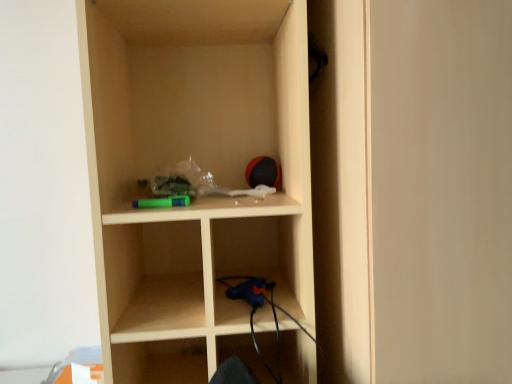
Question: Considering the relative positions of matte wood door at center and matte wood shelf at center in the image provided, is matte wood door at center to the left or to the right of matte wood shelf at center?

Choices:
 (A) right
 (B) left

Answer: (A)

Question: Looking at their shapes, would you say matte wood door at center is wider or thinner than matte wood shelf at center?

Choices:
 (A) wide
 (B) thin

Answer: (A)

Question: From the image's perspective, is matte wood door at center above or below matte wood shelf at center?

Choices:
 (A) below
 (B) above

Answer: (A)

Question: From the image's perspective, is matte wood shelf at center positioned above or below matte wood door at center?

Choices:
 (A) above
 (B) below

Answer: (A)

Question: Is matte wood shelf at center situated inside matte wood door at center or outside?

Choices:
 (A) outside
 (B) inside

Answer: (A)

Question: From their relative heights in the image, would you say matte wood shelf at center is taller or shorter than matte wood door at center?

Choices:
 (A) short
 (B) tall

Answer: (A)

Question: From a real-world perspective, is matte wood shelf at center positioned above or below matte wood door at center?

Choices:
 (A) above
 (B) below

Answer: (A)